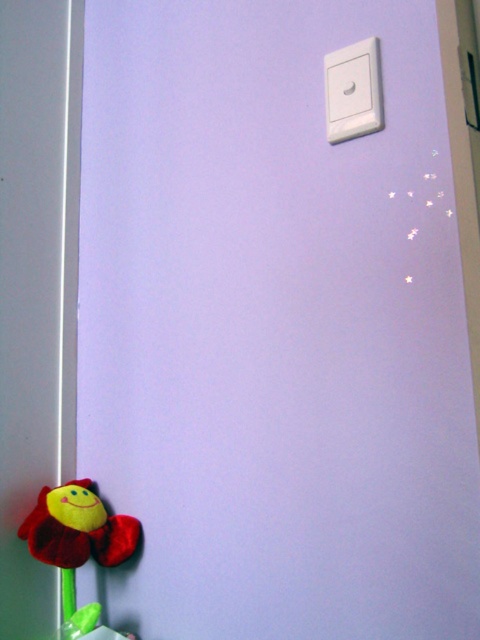
You are trying to hang a new picture frame that is 15 inches wide. The frame needs to be placed above the velvety red flower at bottom left but below the white plastic light switch at upper right. Can the frame fit vertically between these two objects?

The velvety red flower at bottom left is larger than the white plastic light switch at upper right, but without knowing their exact vertical positions or distances between them, it is impossible to determine if the frame will fit.

You are standing in a room with a lavender wall. You need to reach both the velvety red flower at bottom left and the white plastic light switch at upper right. Which object will require you to move closer to the wall?

The velvety red flower at bottom left is to the left of the white plastic light switch at upper right, so you would need to move closer to the wall to reach the velvety red flower at bottom left since it is positioned further away from the viewer compared to the light switch.